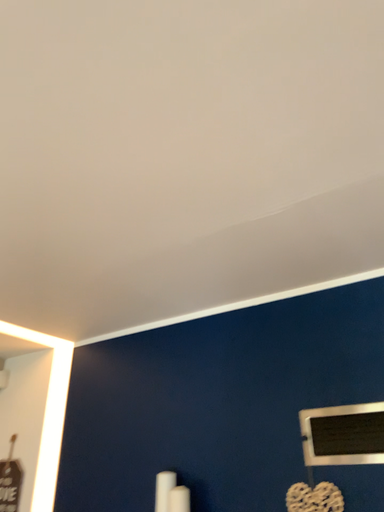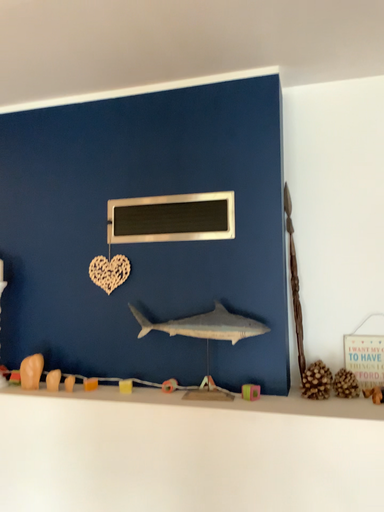
Question: How did the camera likely rotate when shooting the video?

Choices:
 (A) rotated left
 (B) rotated right

Answer: (B)